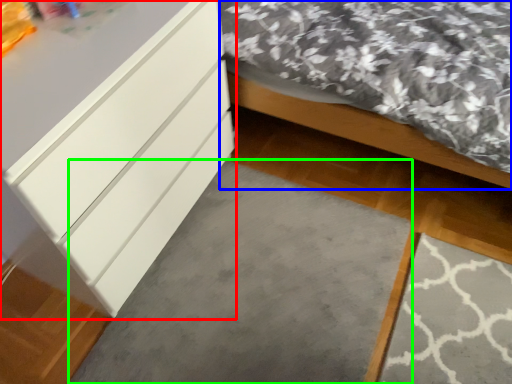
Question: Which object is positioned closest to chest of drawers (highlighted by a red box)? Select from bed (highlighted by a blue box) and concrete (highlighted by a green box).

Choices:
 (A) bed
 (B) concrete

Answer: (B)